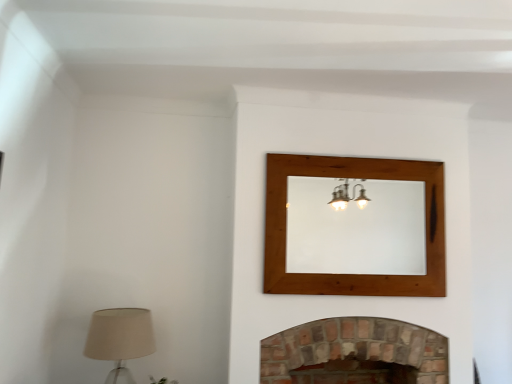
Question: From the image's perspective, does brick fireplace at lower center appear lower than wooden mirror at upper center?

Choices:
 (A) yes
 (B) no

Answer: (A)

Question: Does brick fireplace at lower center appear on the right side of wooden mirror at upper center?

Choices:
 (A) no
 (B) yes

Answer: (A)

Question: Is brick fireplace at lower center positioned behind wooden mirror at upper center?

Choices:
 (A) yes
 (B) no

Answer: (B)

Question: Is brick fireplace at lower center taller than wooden mirror at upper center?

Choices:
 (A) yes
 (B) no

Answer: (B)

Question: From a real-world perspective, is brick fireplace at lower center under wooden mirror at upper center?

Choices:
 (A) no
 (B) yes

Answer: (B)

Question: Does brick fireplace at lower center appear on the left side of wooden mirror at upper center?

Choices:
 (A) no
 (B) yes

Answer: (B)

Question: From a real-world perspective, is wooden mirror at upper center physically below beige fabric lampshade at lower left?

Choices:
 (A) yes
 (B) no

Answer: (B)

Question: Can you confirm if wooden mirror at upper center is positioned to the left of beige fabric lampshade at lower left?

Choices:
 (A) yes
 (B) no

Answer: (B)

Question: Considering the relative positions of wooden mirror at upper center and beige fabric lampshade at lower left in the image provided, is wooden mirror at upper center in front of beige fabric lampshade at lower left?

Choices:
 (A) no
 (B) yes

Answer: (A)

Question: Is wooden mirror at upper center bigger than beige fabric lampshade at lower left?

Choices:
 (A) no
 (B) yes

Answer: (A)

Question: Considering the relative sizes of wooden mirror at upper center and beige fabric lampshade at lower left in the image provided, is wooden mirror at upper center smaller than beige fabric lampshade at lower left?

Choices:
 (A) no
 (B) yes

Answer: (B)

Question: From the image's perspective, is wooden mirror at upper center above beige fabric lampshade at lower left?

Choices:
 (A) no
 (B) yes

Answer: (B)

Question: Does brick fireplace at lower center have a smaller size compared to beige fabric lampshade at lower left?

Choices:
 (A) yes
 (B) no

Answer: (B)